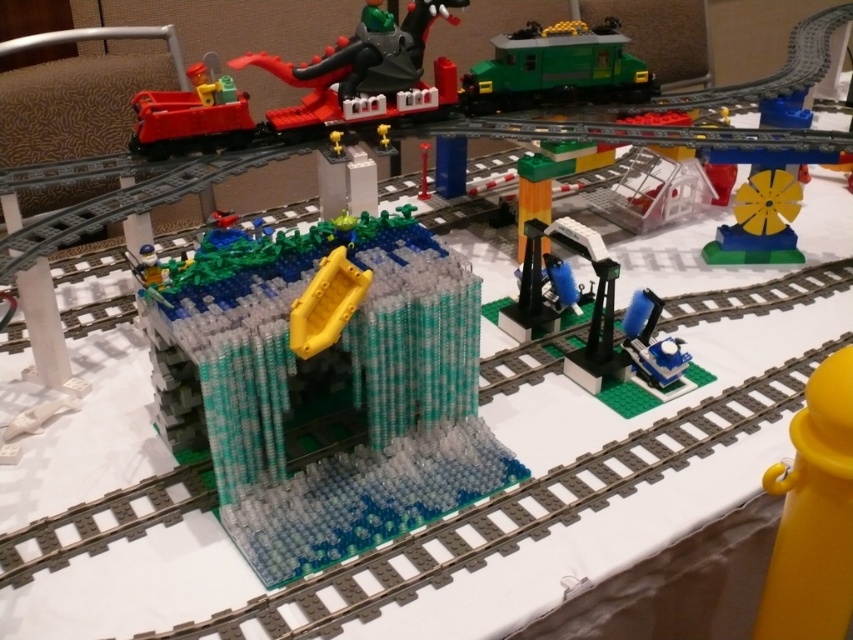
You are a toy designer examining the LEGO train set. You need to determine which of the two trains, the shiny red train car at upper left or the blue plastic train at right, can fit under a low tunnel that is 10 cm in height. Based on their heights, which train would be able to pass through the tunnel without getting stuck?

The shiny red train car at upper left has a greater height compared to blue plastic train at right. Since the tunnel is only 10 cm tall, the blue plastic train at right, being shorter, would be able to pass through the tunnel without getting stuck.

You are a toy designer evaluating the LEGO train set. You need to determine which train can fit through a tunnel that is 10 cm wide. The shiny red train car at upper left and the blue plastic train at right are both candidates. Which train is more likely to fit through the tunnel?

The blue plastic train at right is more likely to fit through the tunnel because the shiny red train car at upper left is wider than the blue plastic train at right according to the description.